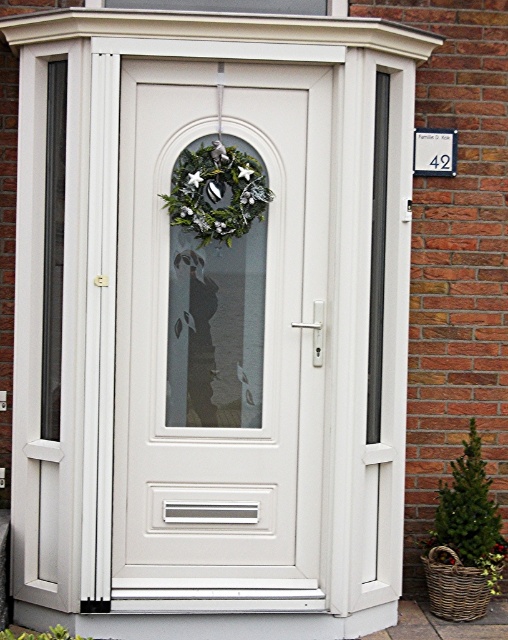
Is point (244, 200) less distant than point (274, 8)?

Yes.

At what (x,y) coordinates should I click in order to perform the action: click on green matte wreath at center. Please return your answer as a coordinate pair (x, y). Looking at the image, I should click on (216, 193).

The image size is (508, 640). What are the coordinates of `green matte wreath at center` in the screenshot? It's located at pyautogui.click(x=216, y=193).

Is the position of white glossy door at center more distant than that of green matte wreath at center?

No, it is in front of green matte wreath at center.

Who is positioned more to the left, white glossy door at center or green matte wreath at center?

green matte wreath at center is more to the left.

What do you see at coordinates (220, 337) in the screenshot?
I see `white glossy door at center` at bounding box center [220, 337].

Find the location of a particular element. white glossy door at center is located at coordinates (220, 337).

Is white glossy door at center above transparent glass window at upper center?

No.

Who is more distant from viewer, (193, 432) or (224, 0)?

Positioned behind is point (224, 0).

This screenshot has width=508, height=640. Find the location of `white glossy door at center`. white glossy door at center is located at coordinates (220, 337).

Locate an element on the screen. white glossy door at center is located at coordinates (220, 337).